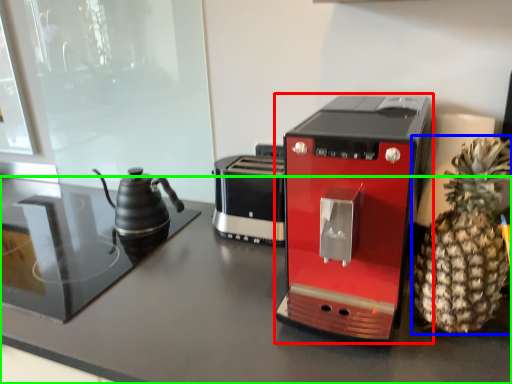
Question: Estimate the real-world distances between objects in this image. Which object is closer to coffee maker (highlighted by a red box), pineapple (highlighted by a blue box) or table (highlighted by a green box)?

Choices:
 (A) pineapple
 (B) table

Answer: (A)